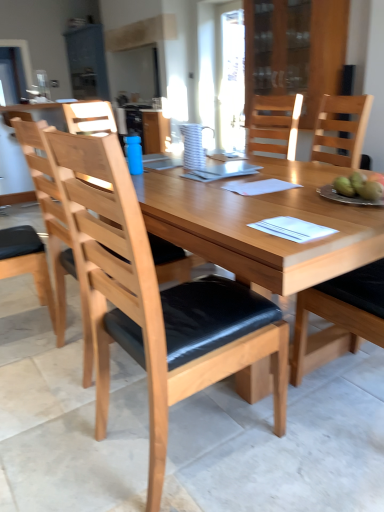
You are a GUI agent. You are given a task and a screenshot of the screen. Output one action in this format:
    pyautogui.click(x=<x>, y=<y>)
    Task: Click on the unoccupied region to the right of light wood/black cushion chair at center, acting as the second chair starting from the right
    The height and width of the screenshot is (512, 384).
    Given the screenshot: What is the action you would take?
    click(307, 454)